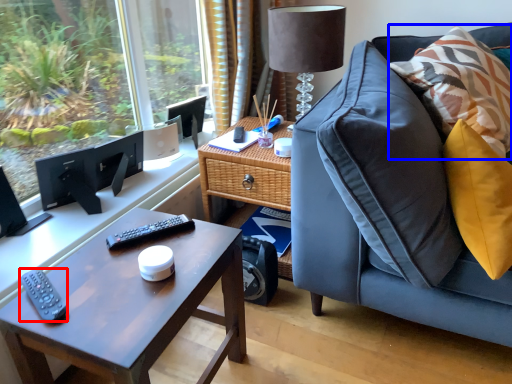
Question: Which object is further to the camera taking this photo, remote (highlighted by a red box) or pillow (highlighted by a blue box)?

Choices:
 (A) remote
 (B) pillow

Answer: (B)